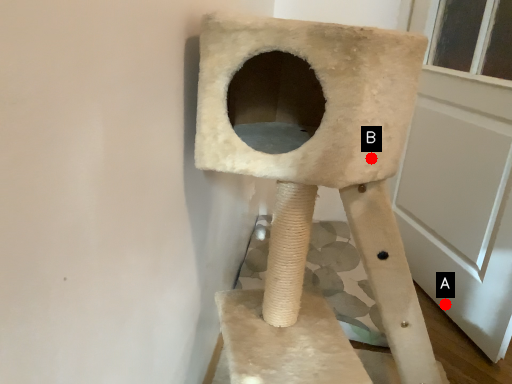
Question: Two points are circled on the image, labeled by A and B beside each circle. Among these points, which one is farthest from the camera?

Choices:
 (A) A is further
 (B) B is further

Answer: (A)